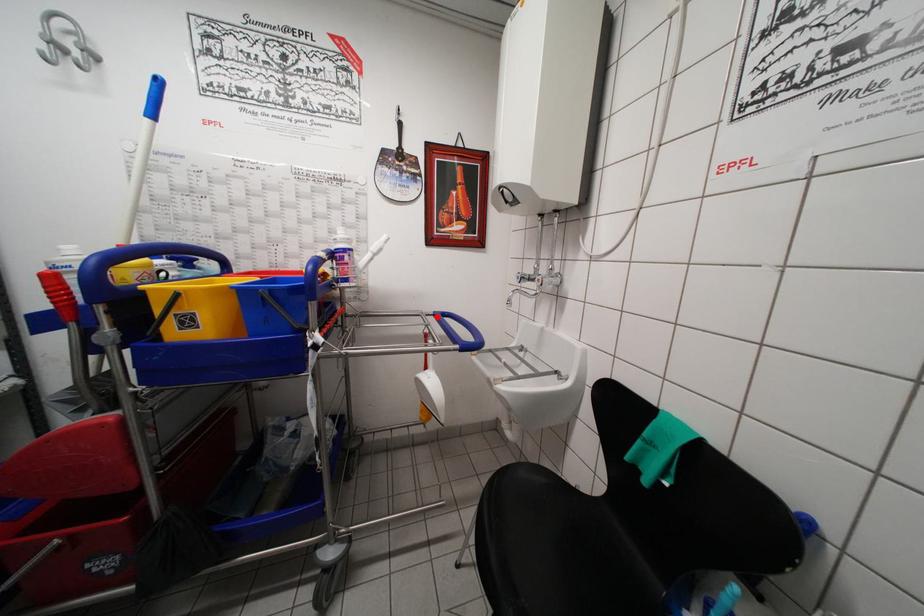
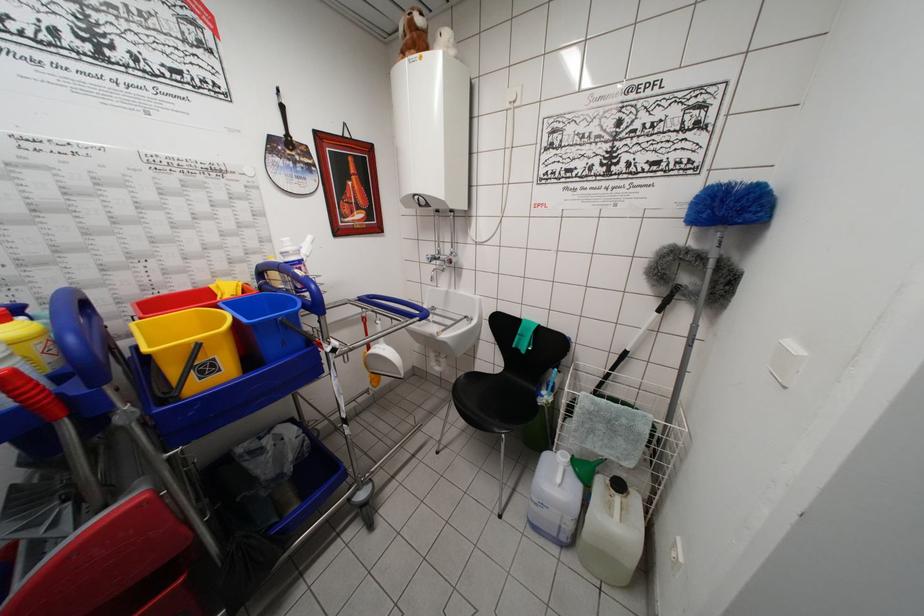
Find the pixel in the second image that matches the highlighted location in the first image.

(360, 302)